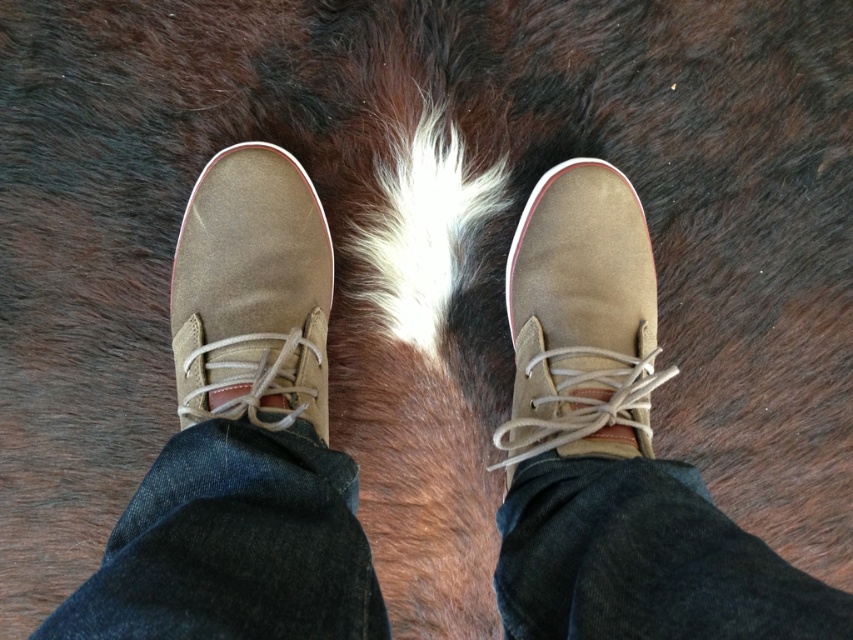
You are standing at the origin of a coordinate system and looking towards the positive x and y directions. You see two points labeled as point (613, 296) and point (212, 211). Based on their positions, which point is closer to you?

Point (212, 211) is closer to you because it has a smaller y coordinate than point (613, 296), which is further away in the positive y direction.